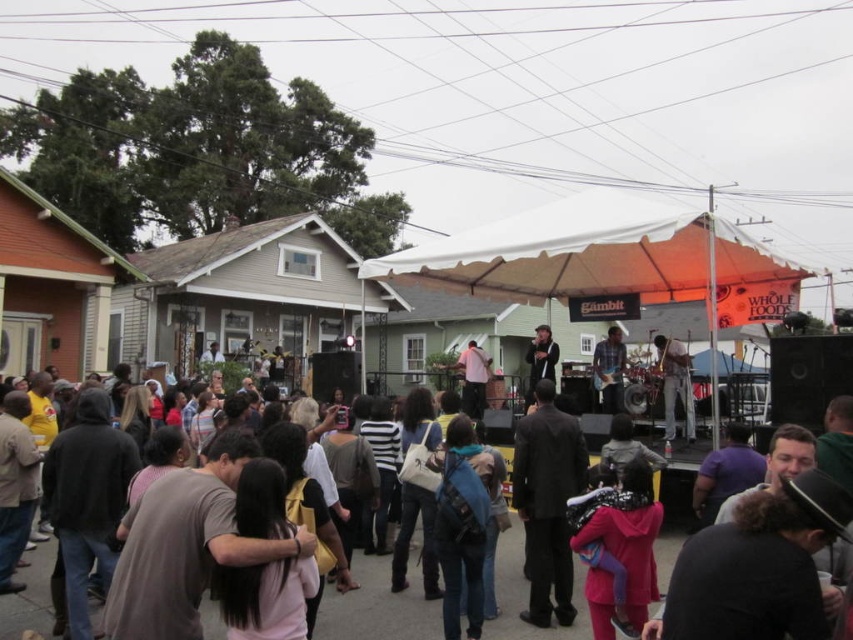
Is plaid fabric shirt at center to the right of matte pink shirt at center from the viewer's perspective?

Correct, you'll find plaid fabric shirt at center to the right of matte pink shirt at center.

Measure the distance from plaid fabric shirt at center to matte pink shirt at center.

plaid fabric shirt at center is 11.76 feet away from matte pink shirt at center.

Where is `plaid fabric shirt at center`? plaid fabric shirt at center is located at coordinates (608, 369).

The image size is (853, 640). I want to click on plaid fabric shirt at center, so click(x=608, y=369).

Is dark gray suit at center shorter than plaid fabric shirt at center?

No, dark gray suit at center is not shorter than plaid fabric shirt at center.

Locate an element on the screen. dark gray suit at center is located at coordinates (547, 502).

This screenshot has width=853, height=640. In order to click on dark gray suit at center in this screenshot , I will do `click(547, 502)`.

Where is `dark gray suit at center`? dark gray suit at center is located at coordinates (547, 502).

Can you confirm if matte pink shirt at center is positioned to the right of matte black suit at center?

In fact, matte pink shirt at center is to the left of matte black suit at center.

Between point (468, 397) and point (531, 355), which one is positioned behind?

Positioned behind is point (468, 397).

The height and width of the screenshot is (640, 853). I want to click on matte pink shirt at center, so click(x=473, y=378).